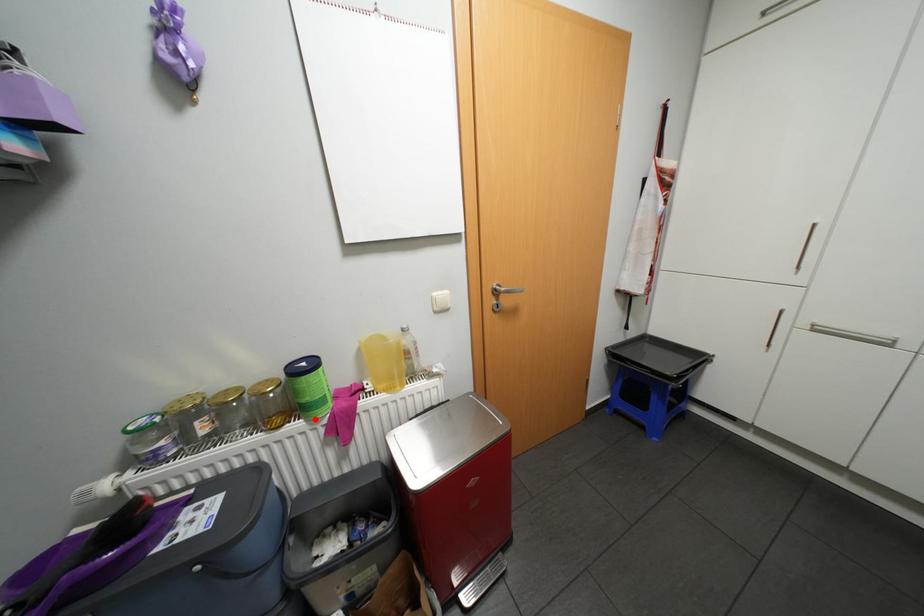
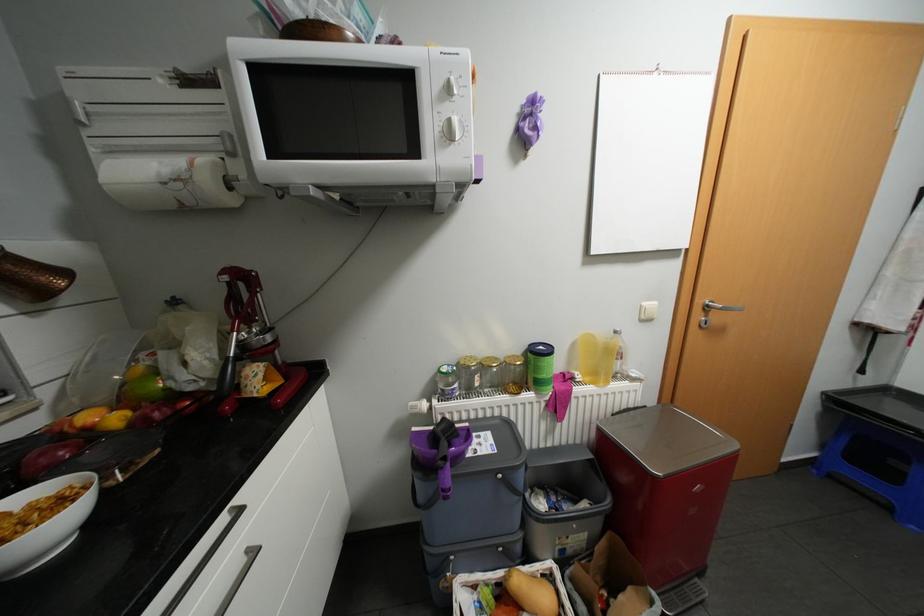
The point at the highlighted location is marked in the first image. Where is the corresponding point in the second image?

(544, 392)